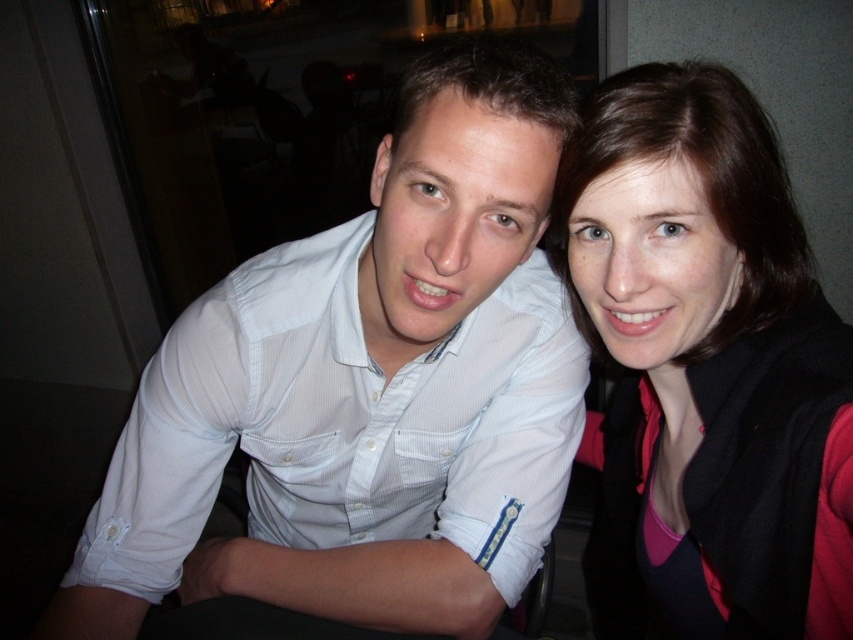
How distant is white textured shirt at center from matte black jacket at upper right?

white textured shirt at center is 9.13 inches from matte black jacket at upper right.

Which is more to the left, white textured shirt at center or matte black jacket at upper right?

white textured shirt at center

The width and height of the screenshot is (853, 640). I want to click on white textured shirt at center, so click(x=367, y=388).